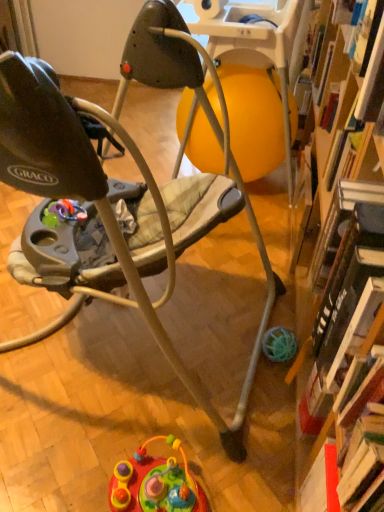
Question: From a real-world perspective, is multicolored plastic toy at lower center located higher than matte gray baby walker at center?

Choices:
 (A) yes
 (B) no

Answer: (B)

Question: From the image's perspective, does multicolored plastic toy at lower center appear higher than matte gray baby walker at center?

Choices:
 (A) yes
 (B) no

Answer: (B)

Question: Is multicolored plastic toy at lower center positioned in front of matte gray baby walker at center?

Choices:
 (A) no
 (B) yes

Answer: (A)

Question: Is multicolored plastic toy at lower center bigger than matte gray baby walker at center?

Choices:
 (A) no
 (B) yes

Answer: (A)

Question: Considering the relative sizes of multicolored plastic toy at lower center and matte gray baby walker at center in the image provided, is multicolored plastic toy at lower center smaller than matte gray baby walker at center?

Choices:
 (A) yes
 (B) no

Answer: (A)

Question: Could matte gray baby walker at center be considered to be inside multicolored plastic toy at lower center?

Choices:
 (A) yes
 (B) no

Answer: (B)

Question: Is matte gray baby walker at center further to the viewer compared to multicolored plastic toy at lower center?

Choices:
 (A) yes
 (B) no

Answer: (B)

Question: Is the position of matte gray baby walker at center less distant than that of multicolored plastic toy at lower center?

Choices:
 (A) no
 (B) yes

Answer: (B)

Question: From a real-world perspective, is matte gray baby walker at center below multicolored plastic toy at lower center?

Choices:
 (A) no
 (B) yes

Answer: (A)

Question: Is matte gray baby walker at center at the right side of multicolored plastic toy at lower center?

Choices:
 (A) no
 (B) yes

Answer: (A)

Question: From the image's perspective, would you say matte gray baby walker at center is shown under multicolored plastic toy at lower center?

Choices:
 (A) no
 (B) yes

Answer: (A)

Question: Is matte gray baby walker at center not close to multicolored plastic toy at lower center?

Choices:
 (A) no
 (B) yes

Answer: (A)

Question: Is multicolored plastic toy at lower center in front of or behind matte gray baby walker at center in the image?

Choices:
 (A) front
 (B) behind

Answer: (B)